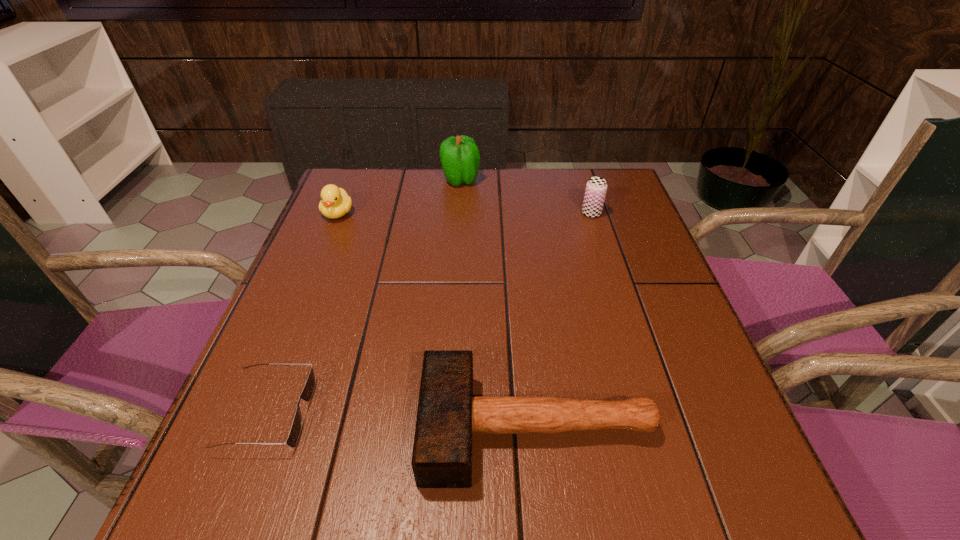
Locate which object is the second closest to the beer can. Please provide its 2D coordinates. Your answer should be formatted as a tuple, i.e. [(x, y)], where the tuple contains the x and y coordinates of a point satisfying the conditions above.

[(448, 414)]

Find the location of a particular element. vacant space that satisfies the following two spatial constraints: 1. on the front side of the tallest object; 2. on the front-facing side of the sunglasses is located at coordinates (446, 413).

Locate an element on the screen. The height and width of the screenshot is (540, 960). free location that satisfies the following two spatial constraints: 1. on the beak of the duckling; 2. on the left side of the beer can is located at coordinates coord(338,213).